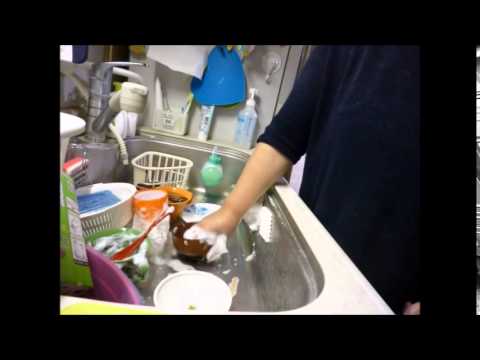
You are a GUI agent. You are given a task and a screenshot of the screen. Output one action in this format:
    pyautogui.click(x=<x>, y=<y>)
    Task: Click on the faucet
    This screenshot has height=360, width=480.
    Given the screenshot: What is the action you would take?
    pyautogui.click(x=100, y=116)